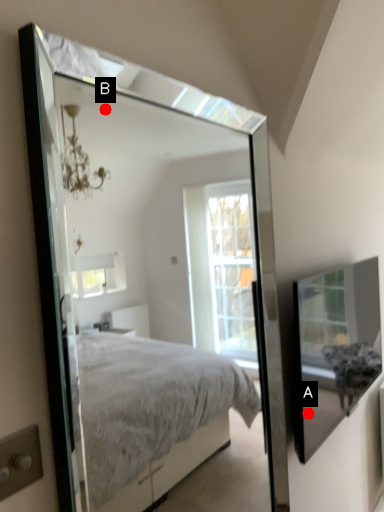
Question: Two points are circled on the image, labeled by A and B beside each circle. Among these points, which one is nearest to the camera?

Choices:
 (A) A is closer
 (B) B is closer

Answer: (A)